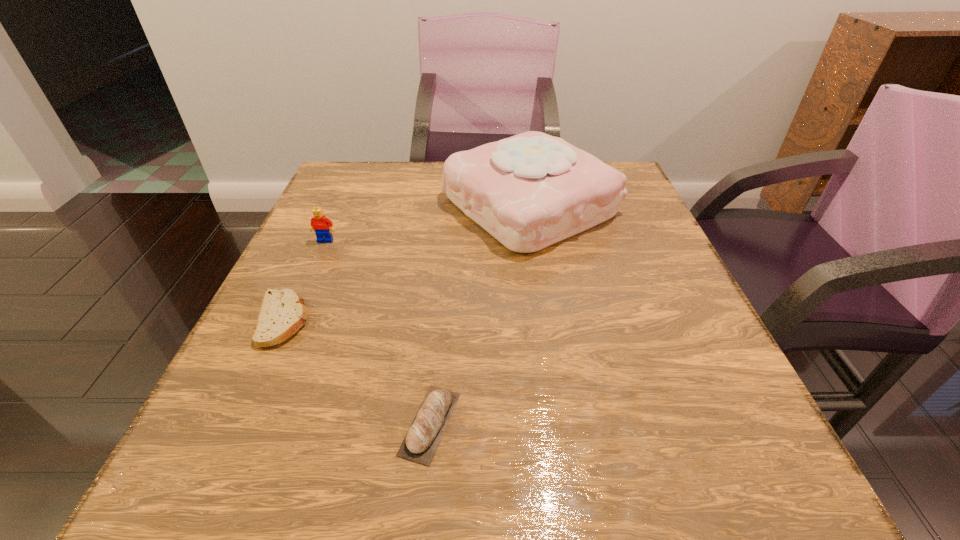
What are the coordinates of `cake` in the screenshot? It's located at (529, 191).

Find the location of a particular element. Lego is located at coordinates (319, 223).

The image size is (960, 540). In order to click on the taller pita bread in this screenshot , I will do `click(427, 428)`.

This screenshot has width=960, height=540. I want to click on the right pita bread, so click(427, 428).

Image resolution: width=960 pixels, height=540 pixels. I want to click on the farther pita bread, so click(x=282, y=313).

At what (x,y) coordinates should I click in order to perform the action: click on the shorter pita bread. Please return your answer as a coordinate pair (x, y). This screenshot has width=960, height=540. Looking at the image, I should click on (282, 313).

Identify the location of free location located on the front of the cake. (552, 347).

Where is `vacant area situated on the front-facing side of the Lego`? Image resolution: width=960 pixels, height=540 pixels. vacant area situated on the front-facing side of the Lego is located at coordinates (301, 296).

Find the location of a particular element. The height and width of the screenshot is (540, 960). vacant space located on the right of the nearer pita bread is located at coordinates 611,423.

Where is `free space located 0.130m on the front of the shorter pita bread`? The height and width of the screenshot is (540, 960). free space located 0.130m on the front of the shorter pita bread is located at coordinates (235, 423).